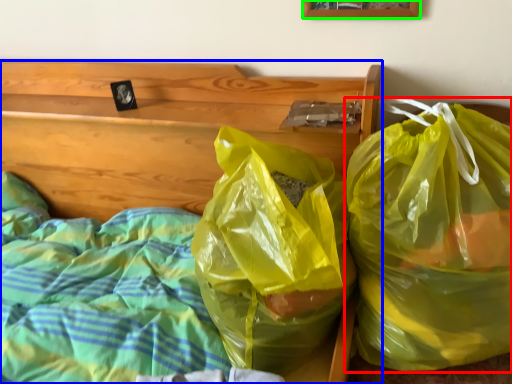
Question: Based on their relative distances, which object is farther from plastic bag (highlighted by a red box)? Choose from furniture (highlighted by a blue box) and picture frame (highlighted by a green box).

Choices:
 (A) furniture
 (B) picture frame

Answer: (B)